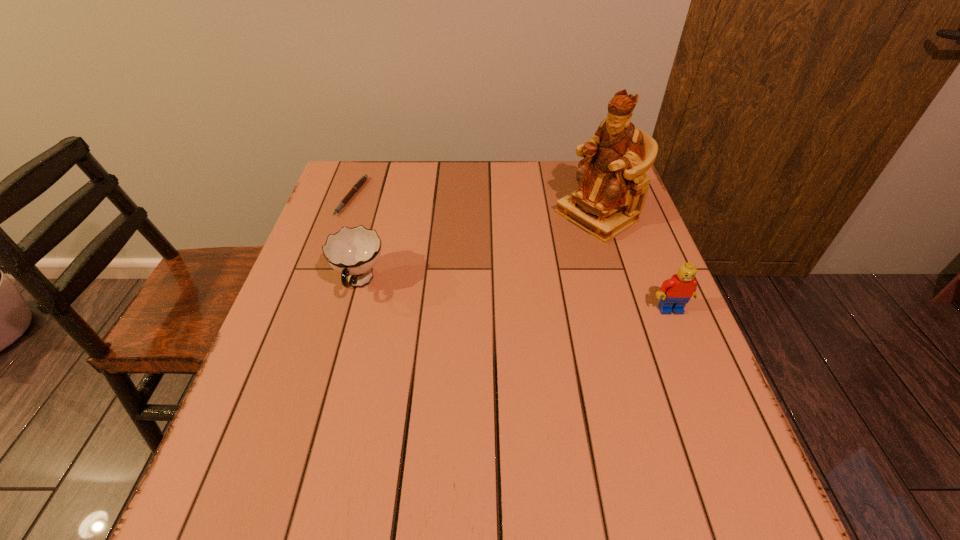
At what (x,y) coordinates should I click in order to perform the action: click on vacant area between the pen and the tallest object. Please return your answer as a coordinate pair (x, y). Looking at the image, I should click on pos(474,207).

Locate an element on the screen. free space between the cup and the second tallest object is located at coordinates (515, 296).

Locate an element on the screen. This screenshot has height=540, width=960. free spot between the pen and the Lego is located at coordinates (511, 253).

Find the location of a particular element. The width and height of the screenshot is (960, 540). object that stands as the third closest to the cup is located at coordinates (675, 292).

Where is `object that is the closest to the Lego`? The width and height of the screenshot is (960, 540). object that is the closest to the Lego is located at coordinates (612, 185).